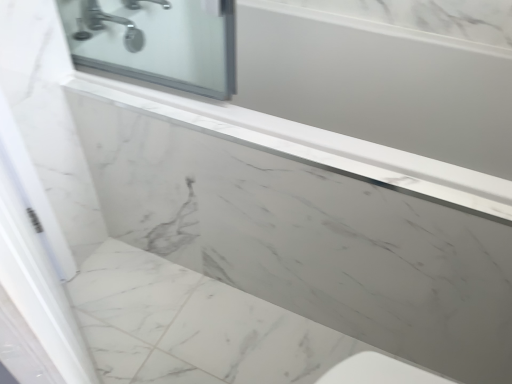
Question: Can you confirm if silver metallic faucet at upper left is shorter than white marble screen door at left?

Choices:
 (A) yes
 (B) no

Answer: (A)

Question: Is white marble screen door at left surrounded by silver metallic faucet at upper left?

Choices:
 (A) yes
 (B) no

Answer: (B)

Question: Is silver metallic faucet at upper left closer to the viewer compared to white marble screen door at left?

Choices:
 (A) yes
 (B) no

Answer: (B)

Question: From the image's perspective, is silver metallic faucet at upper left on white marble screen door at left?

Choices:
 (A) yes
 (B) no

Answer: (A)

Question: Could you tell me if silver metallic faucet at upper left is facing white marble screen door at left?

Choices:
 (A) no
 (B) yes

Answer: (A)

Question: Is silver metallic faucet at upper left completely or partially outside of white marble screen door at left?

Choices:
 (A) no
 (B) yes

Answer: (B)

Question: From a real-world perspective, does white marble screen door at left stand above silver metallic faucet at upper left?

Choices:
 (A) no
 (B) yes

Answer: (A)

Question: Does white marble screen door at left lie behind silver metallic faucet at upper left?

Choices:
 (A) no
 (B) yes

Answer: (A)

Question: Would you say white marble screen door at left is a long distance from silver metallic faucet at upper left?

Choices:
 (A) no
 (B) yes

Answer: (A)

Question: Could you tell me if white marble screen door at left is facing silver metallic faucet at upper left?

Choices:
 (A) yes
 (B) no

Answer: (B)

Question: Is white marble screen door at left to the right of silver metallic faucet at upper left from the viewer's perspective?

Choices:
 (A) yes
 (B) no

Answer: (A)

Question: Does white marble screen door at left have a smaller size compared to silver metallic faucet at upper left?

Choices:
 (A) yes
 (B) no

Answer: (B)

Question: In the image, is white marble screen door at left positioned in front of or behind silver metallic faucet at upper left?

Choices:
 (A) behind
 (B) front

Answer: (B)